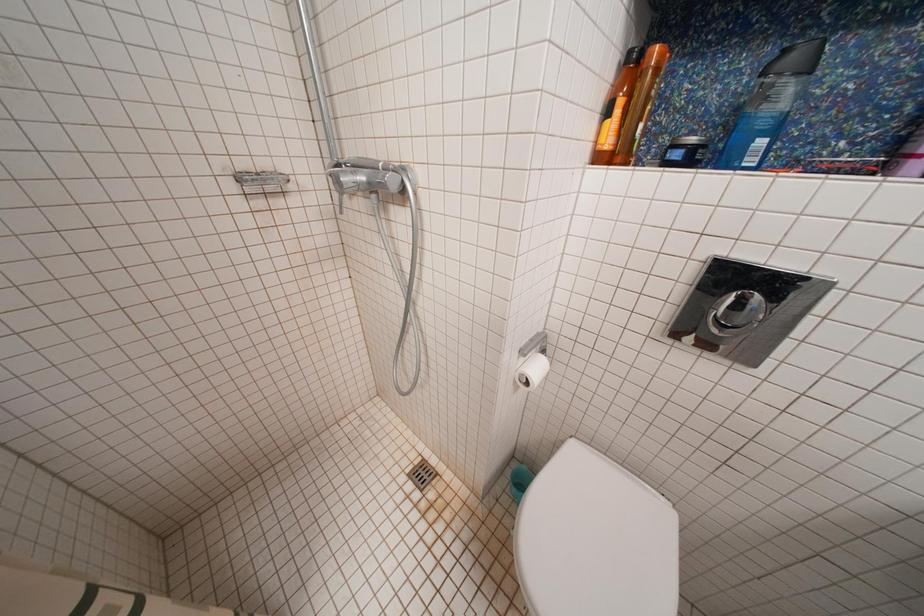
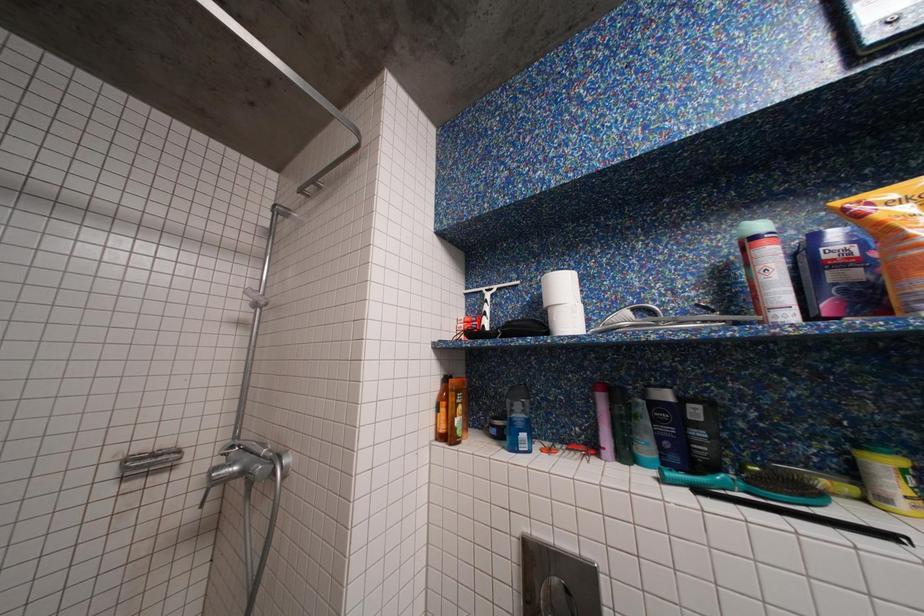
Question: The first image is from the beginning of the video and the second image is from the end. How did the camera likely rotate when shooting the video?

Choices:
 (A) Left
 (B) Right
 (C) Up
 (D) Down

Answer: (C)